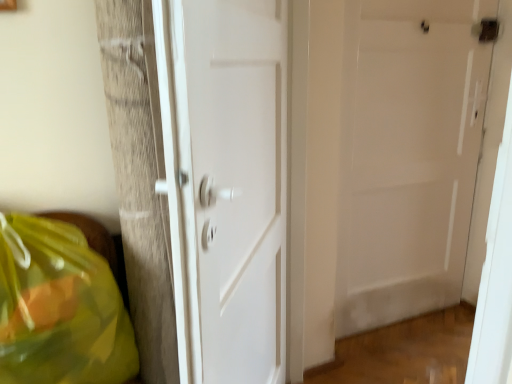
Question: Can you confirm if translucent yellow plastic bag at lower left is taller than white matte door at center, placed as the second door when sorted from left to right?

Choices:
 (A) no
 (B) yes

Answer: (A)

Question: Would you say translucent yellow plastic bag at lower left contains white matte door at center, placed as the second door when sorted from front to back?

Choices:
 (A) no
 (B) yes

Answer: (A)

Question: From the image's perspective, is translucent yellow plastic bag at lower left below white matte door at center, placed as the second door when sorted from left to right?

Choices:
 (A) yes
 (B) no

Answer: (A)

Question: Is translucent yellow plastic bag at lower left behind white matte door at center, positioned as the 1th door in back-to-front order?

Choices:
 (A) no
 (B) yes

Answer: (A)

Question: From the image's perspective, does translucent yellow plastic bag at lower left appear higher than white matte door at center, placed as the second door when sorted from left to right?

Choices:
 (A) no
 (B) yes

Answer: (A)

Question: Choose the correct answer: Is white glossy door at center, positioned as the 2th door in right-to-left order, inside white matte door at center, positioned as the 1th door in back-to-front order, or outside it?

Choices:
 (A) outside
 (B) inside

Answer: (A)

Question: Based on their positions, is white glossy door at center, the 1th door viewed from the front, located to the left or right of white matte door at center, positioned as the 1th door in back-to-front order?

Choices:
 (A) right
 (B) left

Answer: (B)

Question: In terms of size, does white glossy door at center, the 1th door from the left, appear bigger or smaller than white matte door at center, placed as the second door when sorted from left to right?

Choices:
 (A) small
 (B) big

Answer: (B)

Question: From a real-world perspective, is white glossy door at center, positioned as the 2th door in right-to-left order, physically located above or below white matte door at center, the first door positioned from the right?

Choices:
 (A) below
 (B) above

Answer: (A)

Question: From the image's perspective, is translucent yellow plastic bag at lower left located above or below white matte door at center, placed as the second door when sorted from left to right?

Choices:
 (A) below
 (B) above

Answer: (A)

Question: From a real-world perspective, is translucent yellow plastic bag at lower left physically located above or below white matte door at center, placed as the second door when sorted from front to back?

Choices:
 (A) below
 (B) above

Answer: (A)

Question: In terms of size, does translucent yellow plastic bag at lower left appear bigger or smaller than white matte door at center, positioned as the 1th door in back-to-front order?

Choices:
 (A) small
 (B) big

Answer: (B)

Question: Relative to white matte door at center, positioned as the 1th door in back-to-front order, is translucent yellow plastic bag at lower left in front or behind?

Choices:
 (A) front
 (B) behind

Answer: (A)

Question: Visually, is white glossy door at center, the 1th door from the left, positioned to the left or to the right of translucent yellow plastic bag at lower left?

Choices:
 (A) left
 (B) right

Answer: (B)

Question: From a real-world perspective, is white glossy door at center, positioned as the 2th door in right-to-left order, physically located above or below translucent yellow plastic bag at lower left?

Choices:
 (A) above
 (B) below

Answer: (A)